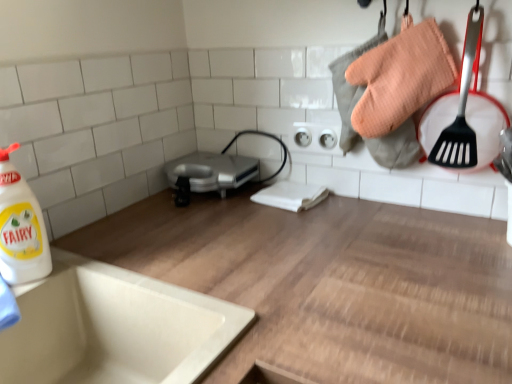
The image size is (512, 384). What are the coordinates of `vacant area that lies in front of silver metallic toaster at center` in the screenshot? It's located at (197, 224).